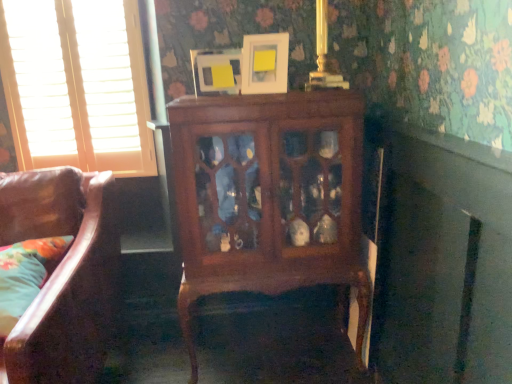
This screenshot has width=512, height=384. In order to click on vacant space underneath mahogany cabinet at center (from a real-world perspective) in this screenshot , I will do `click(279, 364)`.